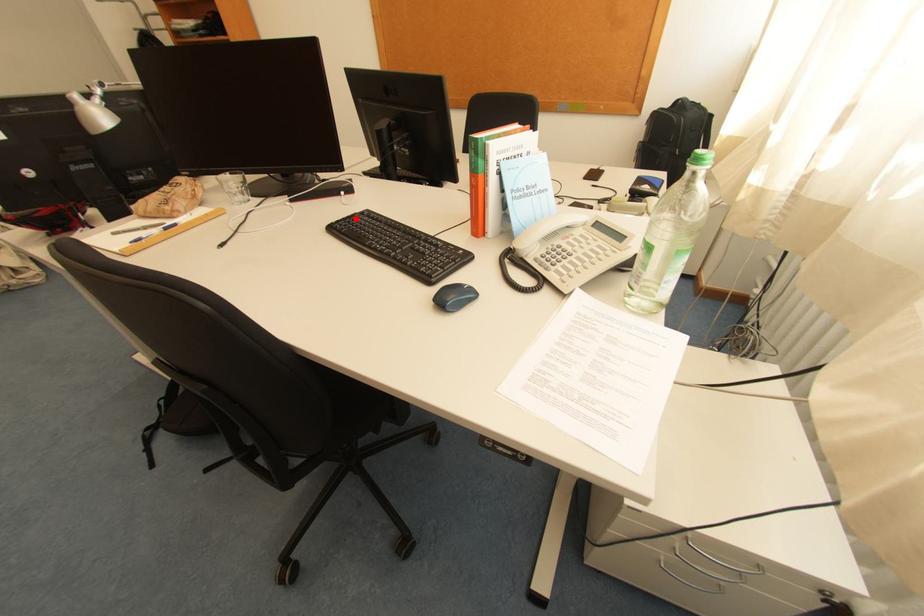
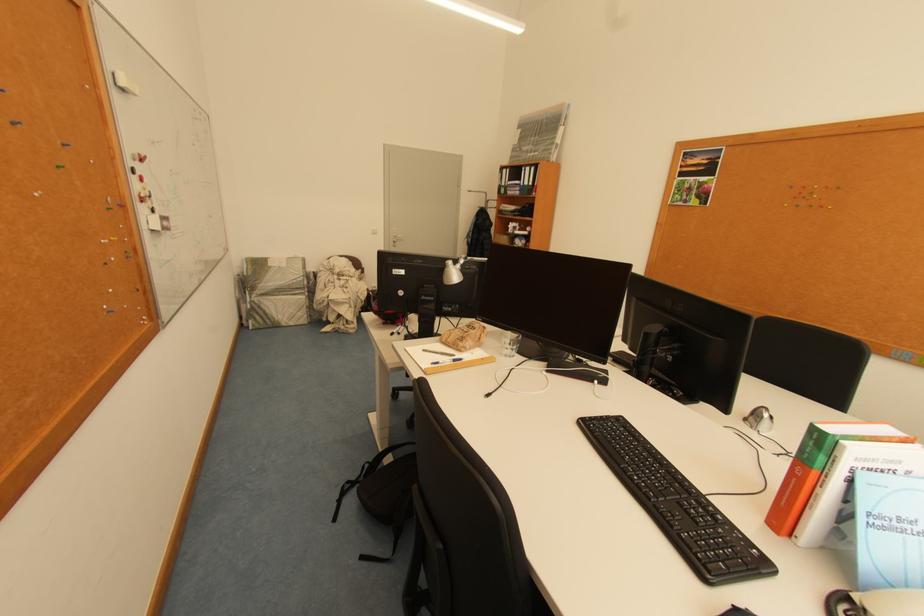
In the second image, find the point that corresponds to the highlighted location in the first image.

(610, 419)